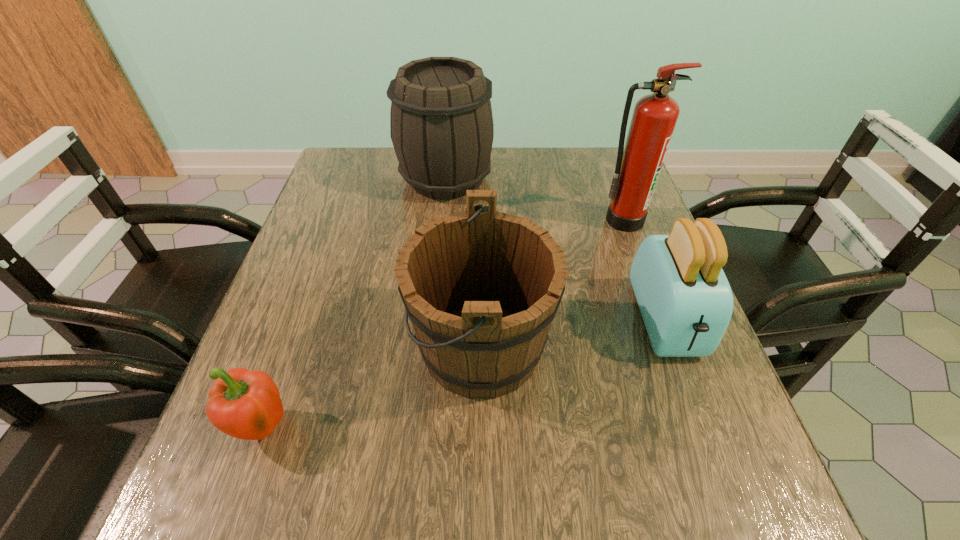
Locate an element on the screen. Image resolution: width=960 pixels, height=540 pixels. vacant space that satisfies the following two spatial constraints: 1. with the nozzle pointing from the back of the fire extinguisher; 2. on the side of the nearer wine bucket with the handle for carrying is located at coordinates click(669, 347).